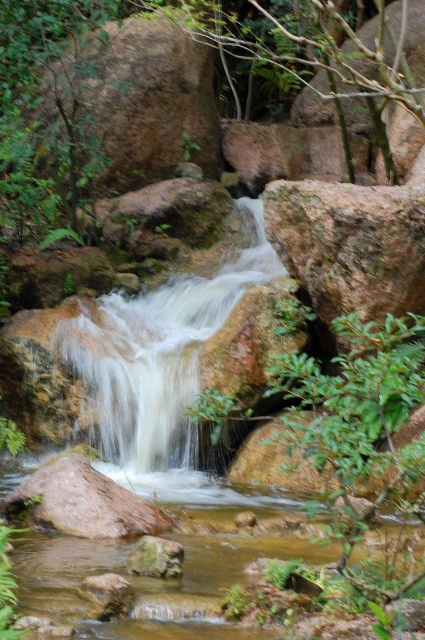
You are standing at the bottom of the waterfall in the image. You see a point marked at coordinates (136, 100). What object is located at that point?

The point at coordinates (136, 100) corresponds to the rustic granite boulder at upper left.